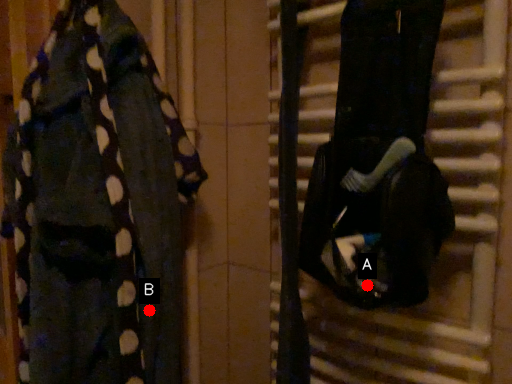
Question: Two points are circled on the image, labeled by A and B beside each circle. Among these points, which one is nearest to the camera?

Choices:
 (A) A is closer
 (B) B is closer

Answer: (A)